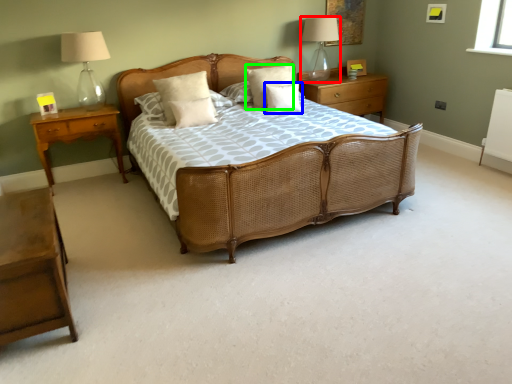
Question: Considering the real-world distances, which object is closest to table lamp (highlighted by a red box)? pillow (highlighted by a blue box) or pillow (highlighted by a green box).

Choices:
 (A) pillow
 (B) pillow

Answer: (B)